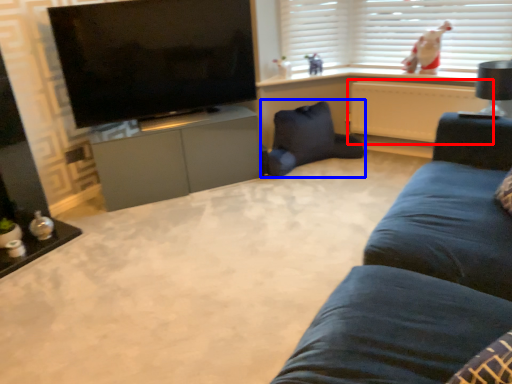
Question: Among these objects, which one is farthest to the camera, radiator (highlighted by a red box) or swivel chair (highlighted by a blue box)?

Choices:
 (A) radiator
 (B) swivel chair

Answer: (B)